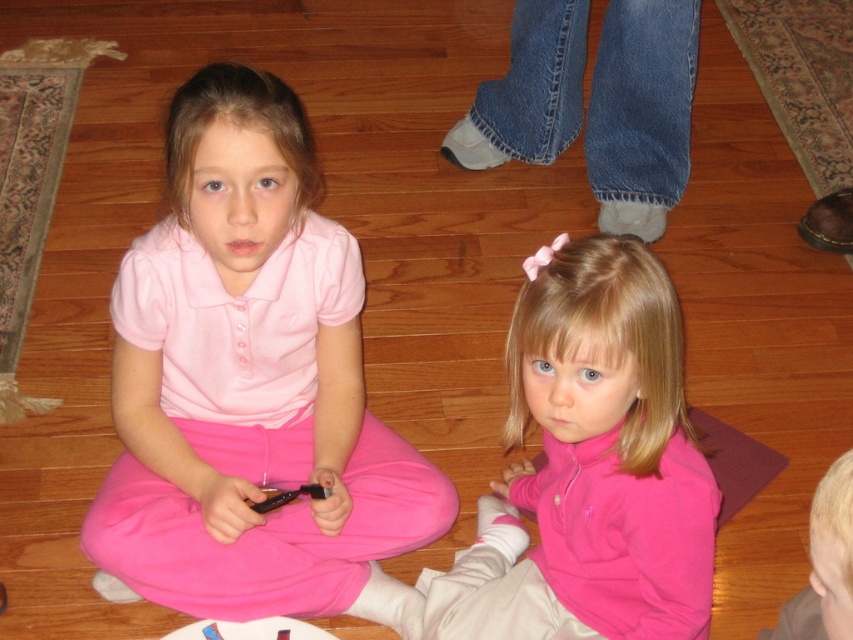
In the scene shown: You are a delivery robot with a box that is 3 feet wide. You need to move between the matte pink shirt at center and the denim jeans at upper center. Can you fit through the space between them?

The distance between the matte pink shirt at center and the denim jeans at upper center is 3.45 feet. Since the box is 3 feet wide, it can fit through the space between them as 3.45 feet is wider than 3 feet.

You are a parent trying to locate a missing button on your child. The button is at point (590,465). Where should you look based on the image?

The point (590,465) is on the pink fleece jacket at lower center, so you should look on the pink fleece jacket at lower center for the missing button.